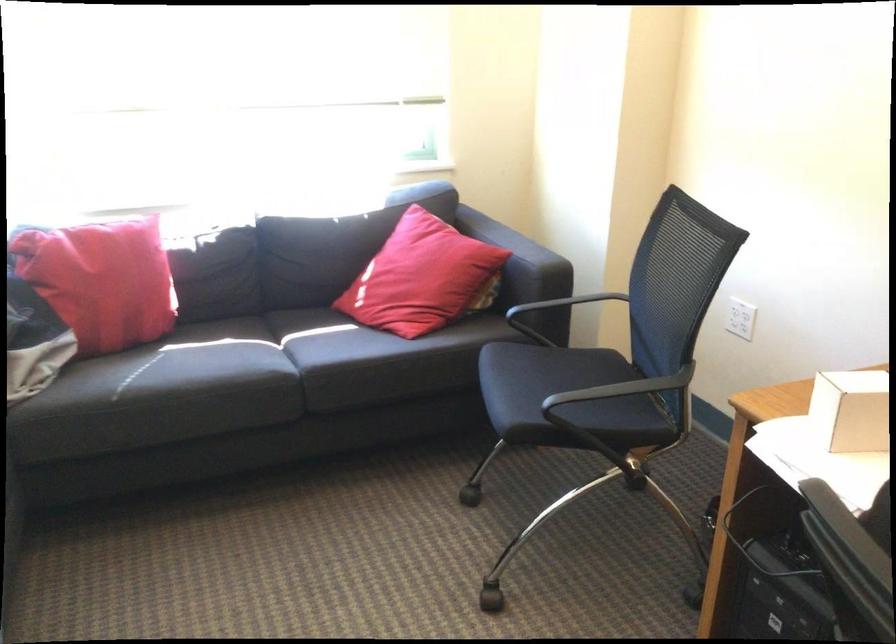
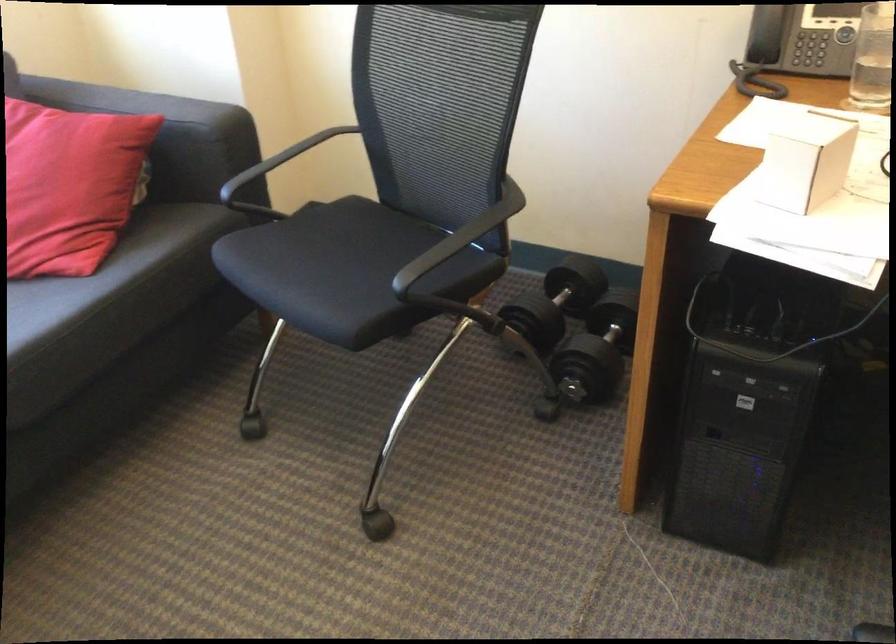
The point at [547,391] is marked in the first image. Where is the corresponding point in the second image?

(343, 270)